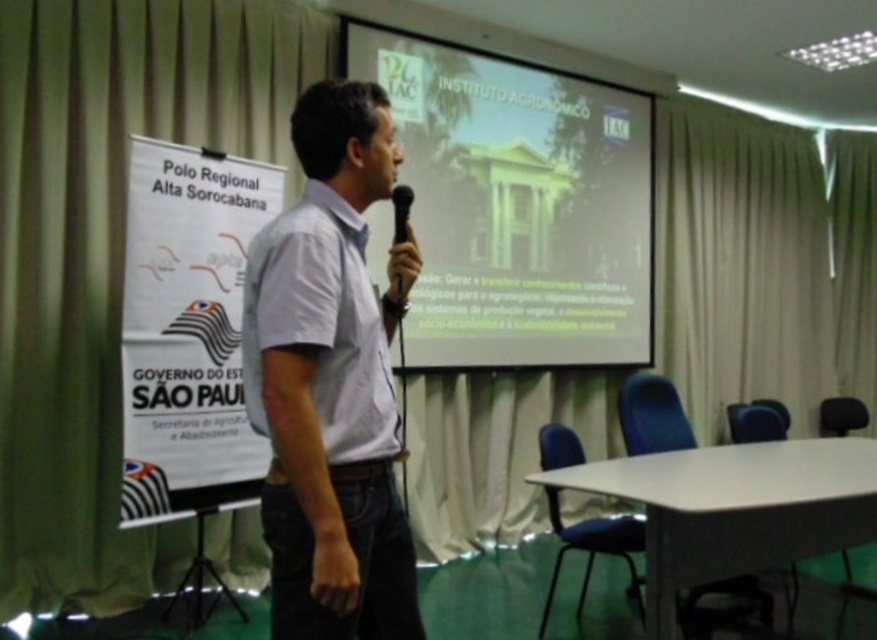
Question: Which object is positioned farthest from the white paperboard at left?

Choices:
 (A) white shirt at center
 (B) black plastic microphone at center
 (C) white glossy projector screen at upper center
 (D) green fabric curtain at upper left

Answer: (A)

Question: Which point is closer to the camera?

Choices:
 (A) (361, 470)
 (B) (362, 365)

Answer: (B)

Question: Is the position of white glossy projector screen at upper center more distant than that of white paperboard at left?

Choices:
 (A) yes
 (B) no

Answer: (A)

Question: Is green fabric curtain at upper left thinner than black plastic microphone at center?

Choices:
 (A) no
 (B) yes

Answer: (A)

Question: Based on their relative distances, which object is nearer to the white glossy projector screen at upper center?

Choices:
 (A) white matte shirt at center
 (B) white shirt at center

Answer: (A)

Question: Does white shirt at center appear over white paperboard at left?

Choices:
 (A) yes
 (B) no

Answer: (B)